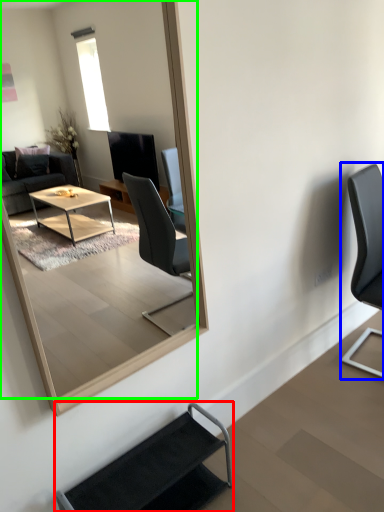
Question: Which object is positioned closest to chair (highlighted by a red box)? Select from chair (highlighted by a blue box) and mirror (highlighted by a green box).

Choices:
 (A) chair
 (B) mirror

Answer: (A)